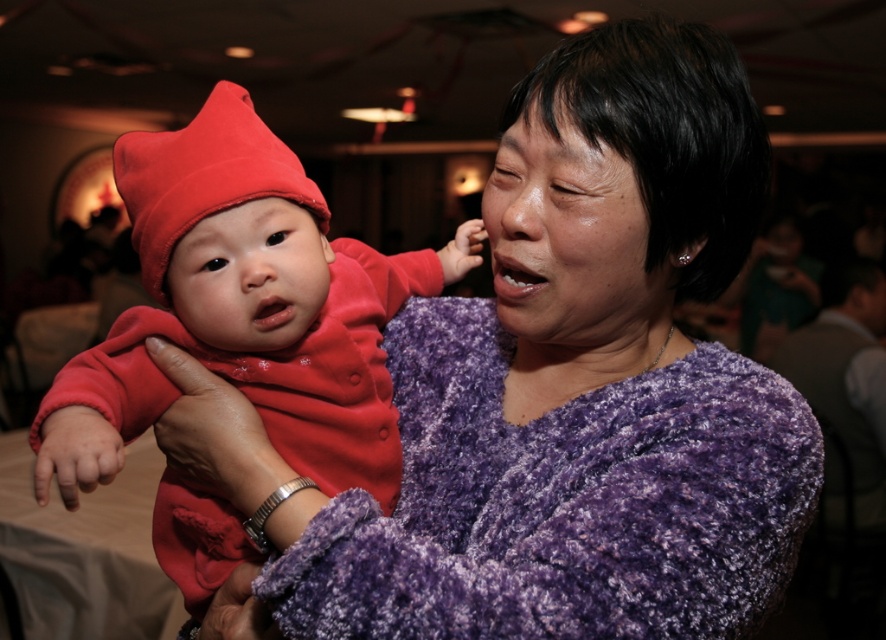
Question: Can you confirm if purple fuzzy sweater at center is positioned below purple fuzzy dress at center?

Choices:
 (A) no
 (B) yes

Answer: (A)

Question: Where is purple fuzzy sweater at center located in relation to velvety red baby at center in the image?

Choices:
 (A) below
 (B) above

Answer: (A)

Question: Which object appears closest to the camera in this image?

Choices:
 (A) purple fuzzy dress at center
 (B) velvety red baby at center
 (C) matte red beanie at center
 (D) purple fuzzy sweater at center

Answer: (A)

Question: Can you confirm if purple fuzzy sweater at center is positioned above velvety red baby at center?

Choices:
 (A) yes
 (B) no

Answer: (B)

Question: Estimate the real-world distances between objects in this image. Which object is farther from the velvety red baby at center?

Choices:
 (A) purple fuzzy sweater at center
 (B) purple fuzzy dress at center

Answer: (B)

Question: Among these objects, which one is nearest to the camera?

Choices:
 (A) velvety red baby at center
 (B) matte red beanie at center

Answer: (A)